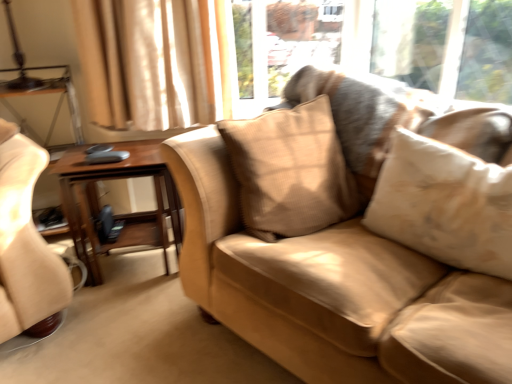
Question: Which direction should I rotate to face beige textured pillow at center, placed as the second pillow when sorted from left to right, — up or down?

Choices:
 (A) up
 (B) down

Answer: (B)

Question: From a real-world perspective, is beige textured pillow at center, placed as the second pillow when sorted from left to right, physically above suede-like beige couch at center?

Choices:
 (A) yes
 (B) no

Answer: (A)

Question: Can you confirm if beige textured pillow at center, placed as the second pillow when sorted from left to right, is thinner than suede-like beige couch at center?

Choices:
 (A) yes
 (B) no

Answer: (A)

Question: Does beige textured pillow at center, placed as the second pillow when sorted from left to right, have a greater width compared to suede-like beige couch at center?

Choices:
 (A) no
 (B) yes

Answer: (A)

Question: Can you confirm if beige textured pillow at center, the 1th pillow from the right, is shorter than suede-like beige couch at center?

Choices:
 (A) no
 (B) yes

Answer: (B)

Question: Considering the relative positions of beige textured pillow at center, the 1th pillow from the right, and suede-like beige couch at center in the image provided, is beige textured pillow at center, the 1th pillow from the right, behind suede-like beige couch at center?

Choices:
 (A) no
 (B) yes

Answer: (B)

Question: Is beige textured pillow at center, placed as the second pillow when sorted from left to right, oriented away from suede-like beige couch at center?

Choices:
 (A) yes
 (B) no

Answer: (A)

Question: Is woodenmaterial/texturetable at left positioned far away from suede-like beige couch at center?

Choices:
 (A) no
 (B) yes

Answer: (A)

Question: Is the position of woodenmaterial/texturetable at left more distant than that of suede-like beige couch at center?

Choices:
 (A) yes
 (B) no

Answer: (A)

Question: Does woodenmaterial/texturetable at left touch suede-like beige couch at center?

Choices:
 (A) yes
 (B) no

Answer: (B)

Question: Considering the relative sizes of woodenmaterial/texturetable at left and suede-like beige couch at center in the image provided, is woodenmaterial/texturetable at left wider than suede-like beige couch at center?

Choices:
 (A) no
 (B) yes

Answer: (A)

Question: From the image's perspective, is woodenmaterial/texturetable at left under suede-like beige couch at center?

Choices:
 (A) yes
 (B) no

Answer: (A)

Question: Is suede-like beige couch at center surrounded by woodenmaterial/texturetable at left?

Choices:
 (A) yes
 (B) no

Answer: (B)

Question: Is beige textured pillow at center, the second pillow in the right-to-left sequence, at the right side of woodenmaterial/texturetable at left?

Choices:
 (A) no
 (B) yes

Answer: (B)